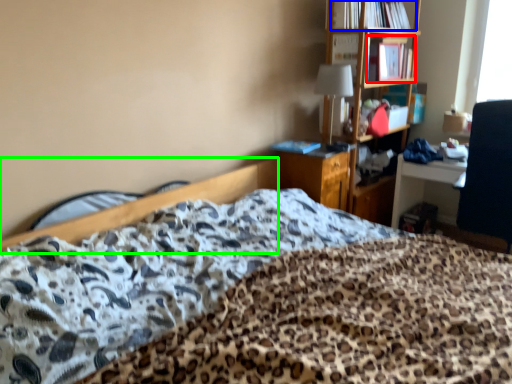
Question: Which object is the closest to the book (highlighted by a red box)? Choose among these: book (highlighted by a blue box) or bed frame (highlighted by a green box).

Choices:
 (A) book
 (B) bed frame

Answer: (A)